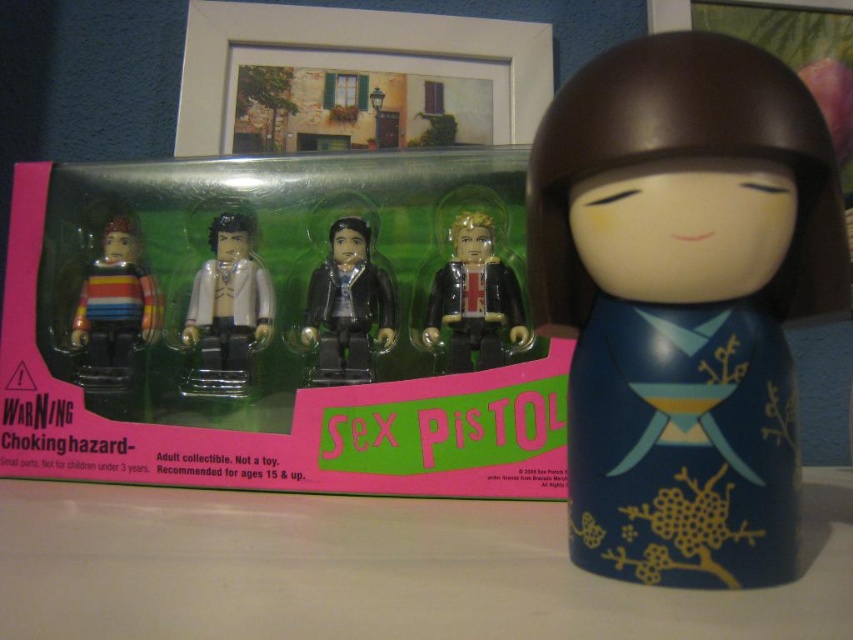
The height and width of the screenshot is (640, 853). Identify the location of white matte minifigure at center. (227, 312).

The image size is (853, 640). In order to click on white matte minifigure at center in this screenshot , I will do `click(227, 312)`.

Which is more to the left, shiny gold minifigure at center or black matte figure at center?

From the viewer's perspective, black matte figure at center appears more on the left side.

Does shiny gold minifigure at center lie in front of black matte figure at center?

Yes, shiny gold minifigure at center is in front of black matte figure at center.

Describe the element at coordinates (474, 301) in the screenshot. The width and height of the screenshot is (853, 640). I see `shiny gold minifigure at center` at that location.

Locate an element on the screen. shiny gold minifigure at center is located at coordinates 474,301.

Is black matte figure at center bigger than striped fabric figure at left?

Actually, black matte figure at center might be smaller than striped fabric figure at left.

Where is `black matte figure at center`? black matte figure at center is located at coordinates (347, 308).